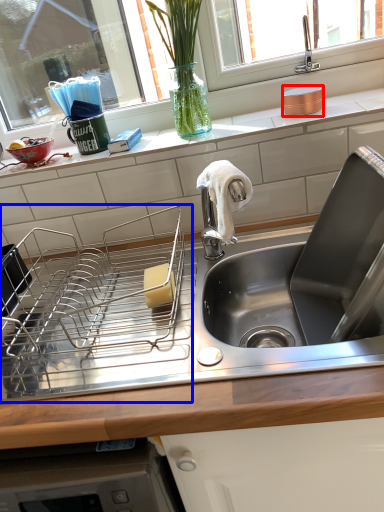
Question: Which point is closer to the camera, appliance (highlighted by a red box) or appliance (highlighted by a blue box)?

Choices:
 (A) appliance
 (B) appliance

Answer: (B)